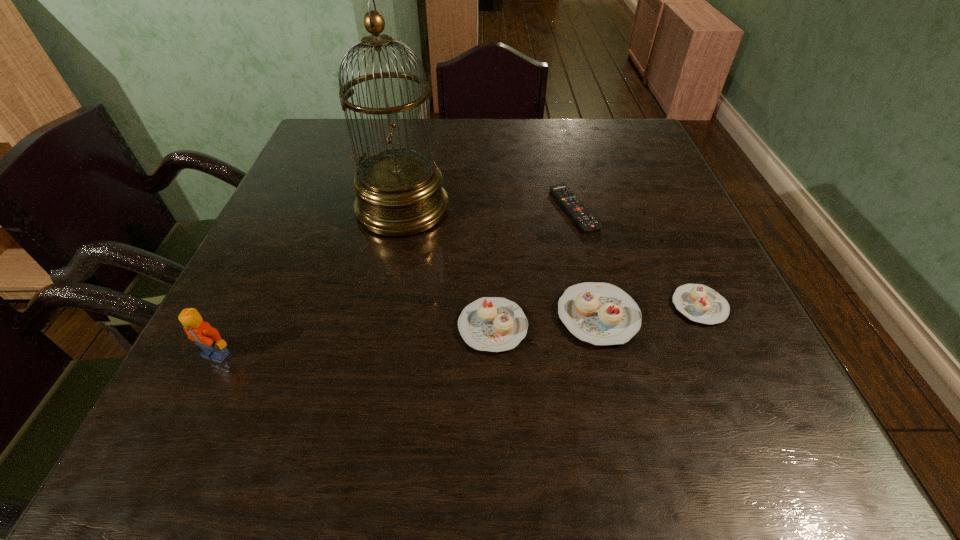
What are the coordinates of `the leftmost cupcake` in the screenshot? It's located at (494, 324).

Identify the location of the third shortest object. click(494, 324).

Identify the location of the tallest cupcake. (600, 313).

You are a GUI agent. You are given a task and a screenshot of the screen. Output one action in this format:
    pyautogui.click(x=<x>, y=<y>)
    Task: Click on the second cupcake from left to right
    
    Given the screenshot: What is the action you would take?
    pyautogui.click(x=600, y=313)

Find the location of a particular element. the rightmost cupcake is located at coordinates (699, 303).

Locate an element on the screen. The image size is (960, 540). the shortest cupcake is located at coordinates (699, 303).

At what (x,y) coordinates should I click in order to perform the action: click on the second object from left to right. Please return your answer as a coordinate pair (x, y). The height and width of the screenshot is (540, 960). Looking at the image, I should click on (399, 193).

This screenshot has height=540, width=960. I want to click on birdcage, so click(399, 193).

Identify the location of the second tallest object. The height and width of the screenshot is (540, 960). (200, 332).

Where is `Lego`? Lego is located at coordinates (200, 332).